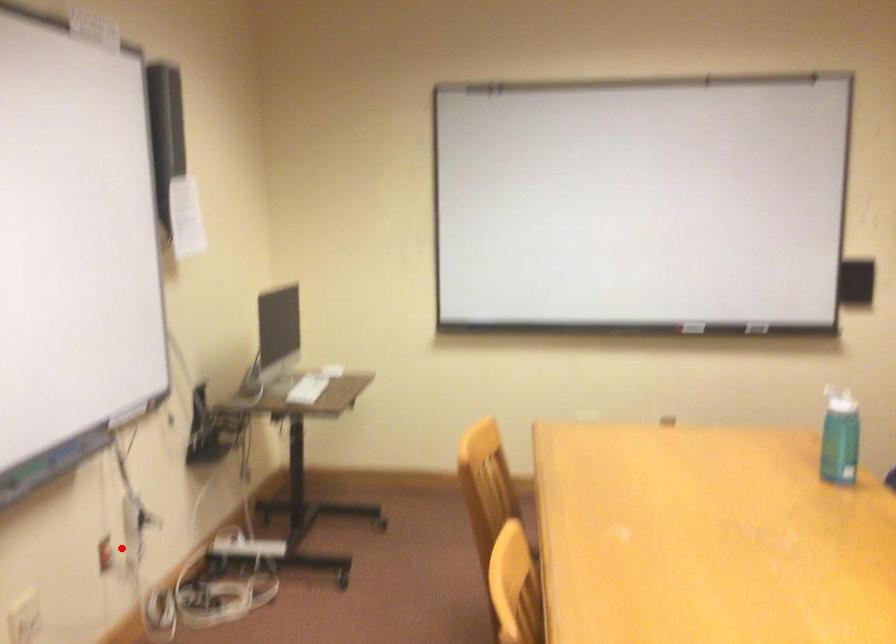
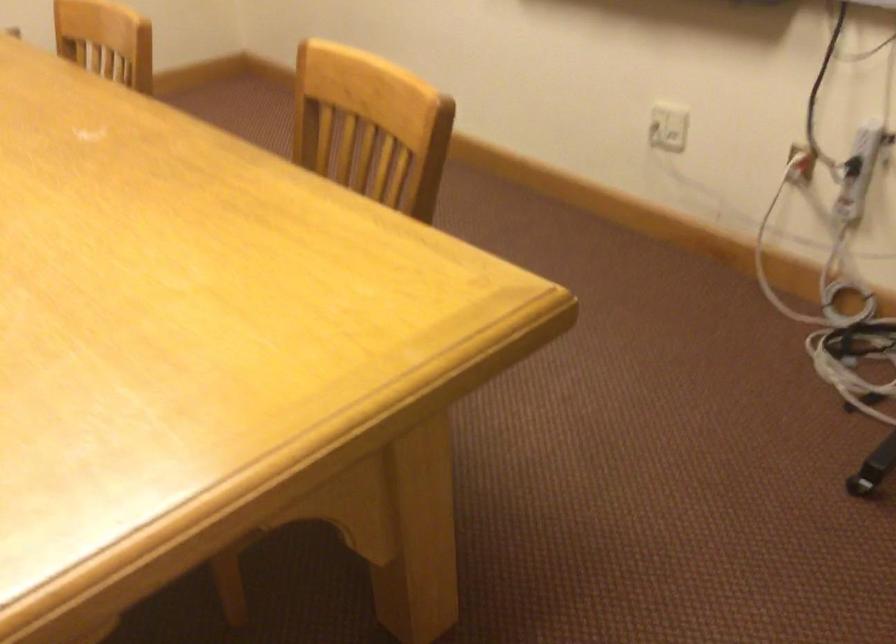
Question: I am providing you with two images of the same scene from different viewpoints. In image1, a red point is highlighted. Considering the same 3D point in image2, which of the following is correct?

Choices:
 (A) It is closer
 (B) It is farther

Answer: (A)